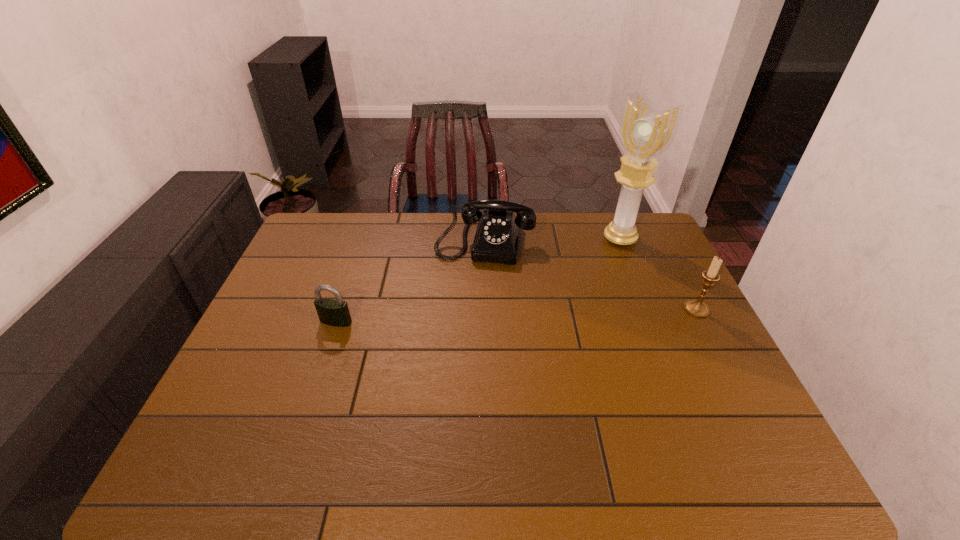
In order to click on free space between the tallest object and the third tallest object in this screenshot , I will do `click(552, 240)`.

Locate an element on the screen. vacant area that lies between the candle holder and the tallest object is located at coordinates (659, 274).

This screenshot has width=960, height=540. I want to click on vacant region between the third tallest object and the third object from left to right, so click(552, 240).

Identify the location of vacant area between the tallest object and the telephone. The height and width of the screenshot is (540, 960). (552, 240).

You are a GUI agent. You are given a task and a screenshot of the screen. Output one action in this format:
    pyautogui.click(x=<x>, y=<y>)
    Task: Click on the free space between the award and the rightmost object
    
    Given the screenshot: What is the action you would take?
    pyautogui.click(x=659, y=274)

This screenshot has height=540, width=960. What are the coordinates of `vacant region between the candle holder and the third object from left to right` in the screenshot? It's located at (659, 274).

Where is `the third closest object to the third object from right to left`? the third closest object to the third object from right to left is located at coordinates (697, 308).

Image resolution: width=960 pixels, height=540 pixels. Find the location of `object that is the closest to the tallest object`. object that is the closest to the tallest object is located at coordinates (496, 240).

The height and width of the screenshot is (540, 960). Find the location of `free space that satisfies the following two spatial constraints: 1. on the back side of the shortest object; 2. on the right side of the tallest object`. free space that satisfies the following two spatial constraints: 1. on the back side of the shortest object; 2. on the right side of the tallest object is located at coordinates (364, 239).

Locate an element on the screen. This screenshot has width=960, height=540. vacant space that satisfies the following two spatial constraints: 1. on the back side of the padlock; 2. on the left side of the award is located at coordinates (364, 239).